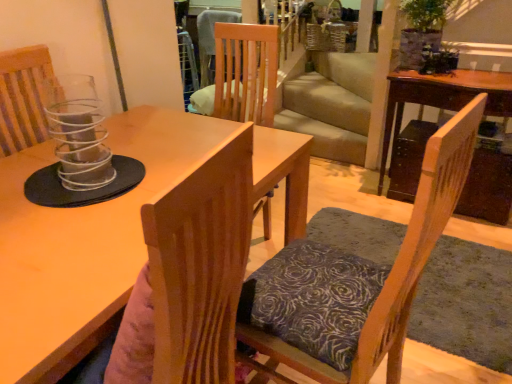
Question: Choose the correct answer: Is wooden table at right, which is the first table from right to left, inside wooden chair with patterned cushion at center, the 1th chair when ordered from right to left, or outside it?

Choices:
 (A) outside
 (B) inside

Answer: (A)

Question: Considering the positions of wooden table at right, arranged as the second table when viewed from the left, and wooden chair with patterned cushion at center, the 2th chair from the left, in the image, is wooden table at right, arranged as the second table when viewed from the left, taller or shorter than wooden chair with patterned cushion at center, the 2th chair from the left,?

Choices:
 (A) tall
 (B) short

Answer: (B)

Question: Which object is positioned farthest from the wooden table at right, which is the 2th table in front-to-back order?

Choices:
 (A) wooden chair with patterned cushion at center, the 1th chair when ordered from right to left
 (B) clear glass candle holder at left
 (C) transparent plastic chair at upper left, placed as the 2th chair when sorted from right to left
 (D) matte wooden table at center, which is the second table from back to front

Answer: (C)

Question: Which object is positioned farthest from the wooden table at right, which is the first table from right to left?

Choices:
 (A) clear glass candle holder at left
 (B) transparent plastic chair at upper left, the 1th chair viewed from the left
 (C) matte wooden table at center, which ranks as the first table in front-to-back order
 (D) wooden chair with patterned cushion at center, the 2th chair from the left

Answer: (B)